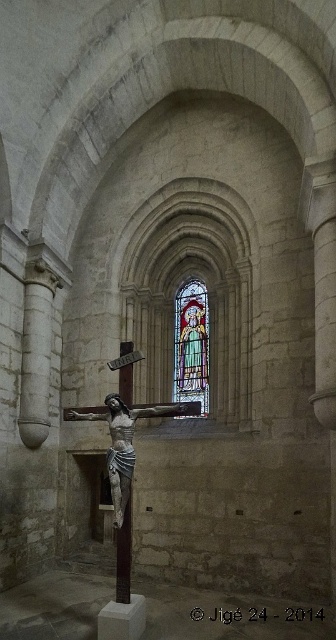
Question: Which point is farther from the camera taking this photo?

Choices:
 (A) (115, 394)
 (B) (202, 371)

Answer: (B)

Question: Where is stained glass window at center located in relation to polished silver crucifix at center in the image?

Choices:
 (A) below
 (B) above

Answer: (B)

Question: Among these points, which one is nearest to the camera?

Choices:
 (A) (117, 464)
 (B) (203, 369)

Answer: (A)

Question: Which point is closer to the camera?

Choices:
 (A) (185, 289)
 (B) (165, 412)

Answer: (B)

Question: From the image, what is the correct spatial relationship of stained glass window at center in relation to polished silver crucifix at center?

Choices:
 (A) above
 (B) below

Answer: (A)

Question: Does stained glass window at center appear over polished silver crucifix at center?

Choices:
 (A) no
 (B) yes

Answer: (B)